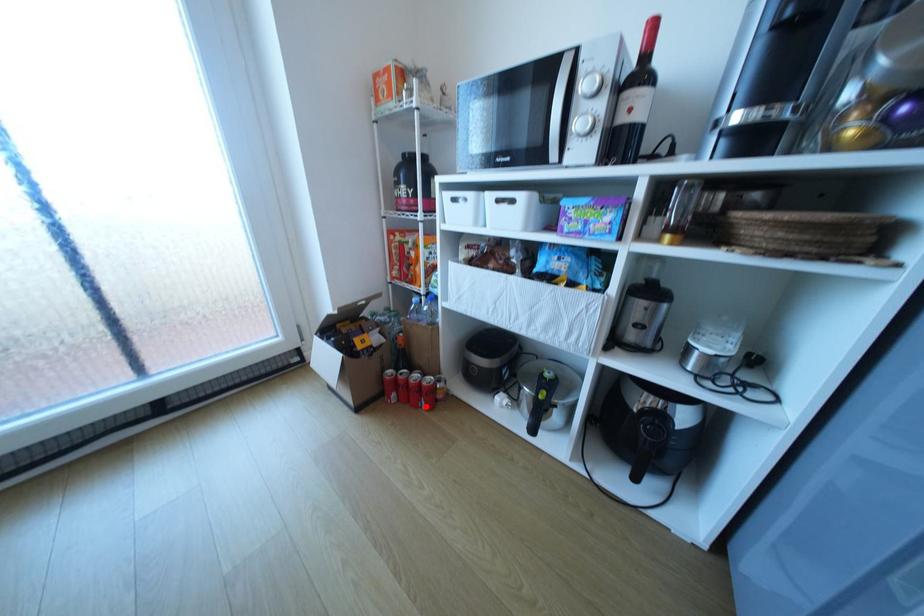
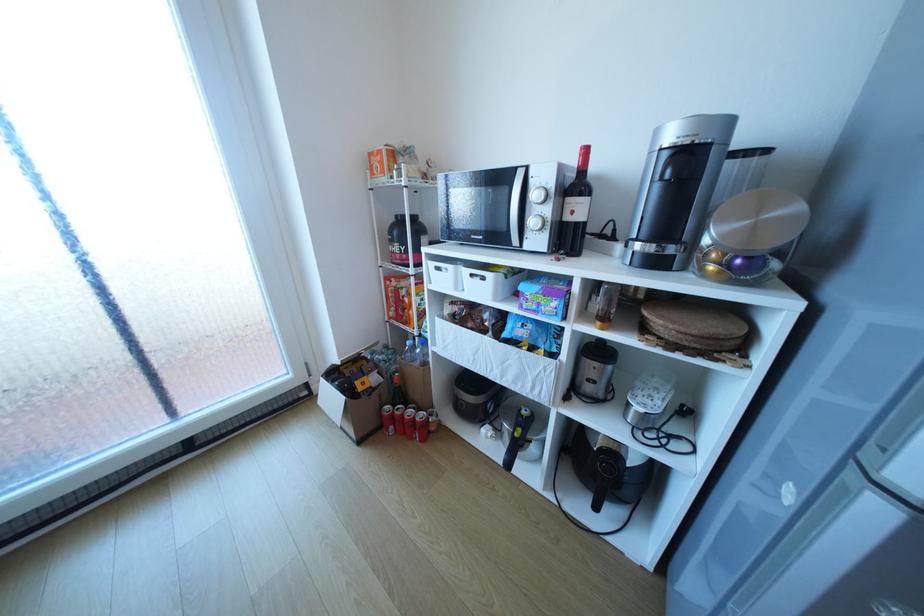
Find the pixel in the second image that matches the highlighted location in the first image.

(420, 438)